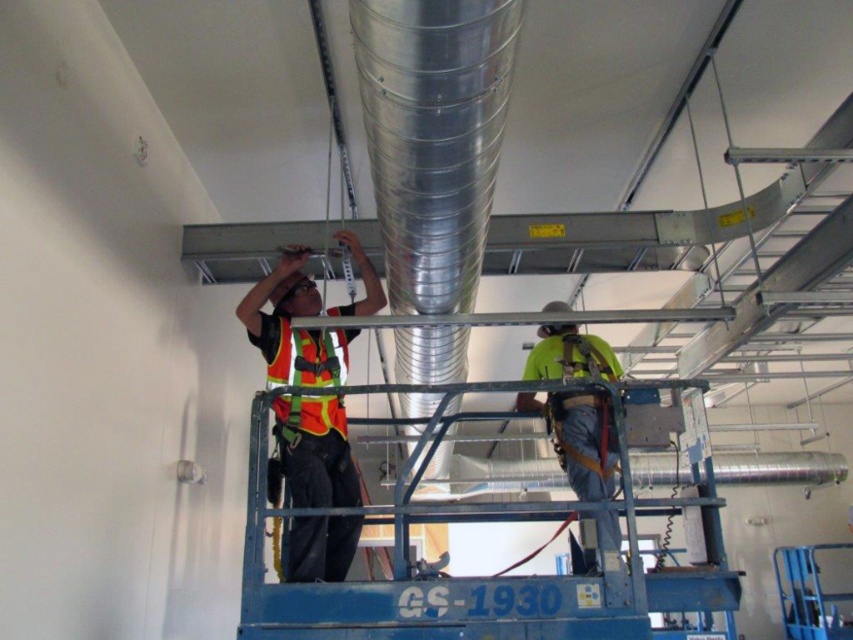
Question: Based on their relative distances, which object is nearer to the reflective orange safety vest at center?

Choices:
 (A) yellow-green reflective safety vest at center
 (B) reflective fabric safety vest at center

Answer: (B)

Question: Does yellow-green reflective safety vest at center have a smaller size compared to reflective fabric safety vest at center?

Choices:
 (A) yes
 (B) no

Answer: (B)

Question: Does yellow-green reflective safety vest at center have a larger size compared to reflective fabric safety vest at center?

Choices:
 (A) yes
 (B) no

Answer: (A)

Question: Among these points, which one is nearest to the camera?

Choices:
 (A) (339, 369)
 (B) (535, 374)

Answer: (A)

Question: Is reflective orange safety vest at center to the left of yellow-green reflective safety vest at center from the viewer's perspective?

Choices:
 (A) no
 (B) yes

Answer: (B)

Question: Which point is farther to the camera?

Choices:
 (A) (308, 492)
 (B) (329, 374)
 (C) (567, 364)

Answer: (C)